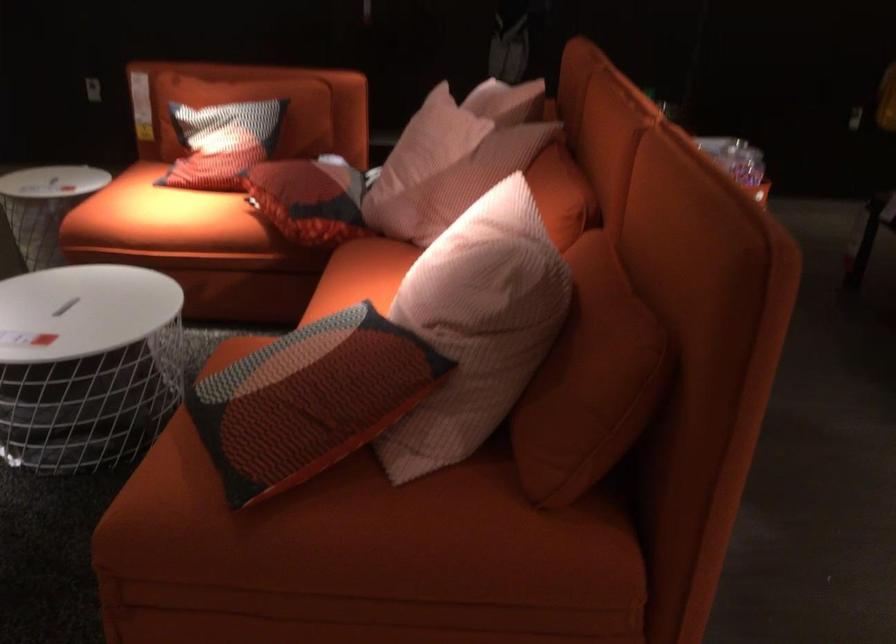
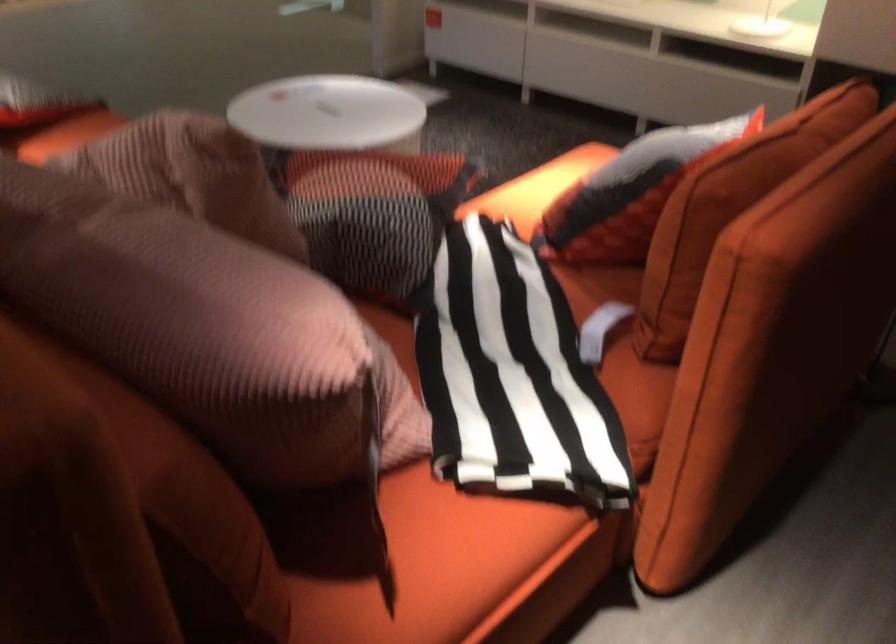
Question: I am providing you with two images of the same scene from different viewpoints. Please identify which objects are invisible in image2.

Choices:
 (A) sofa armrest
 (B) bottle pump handle
 (C) patterned pillow
 (D) red patterned pillow

Answer: (C)